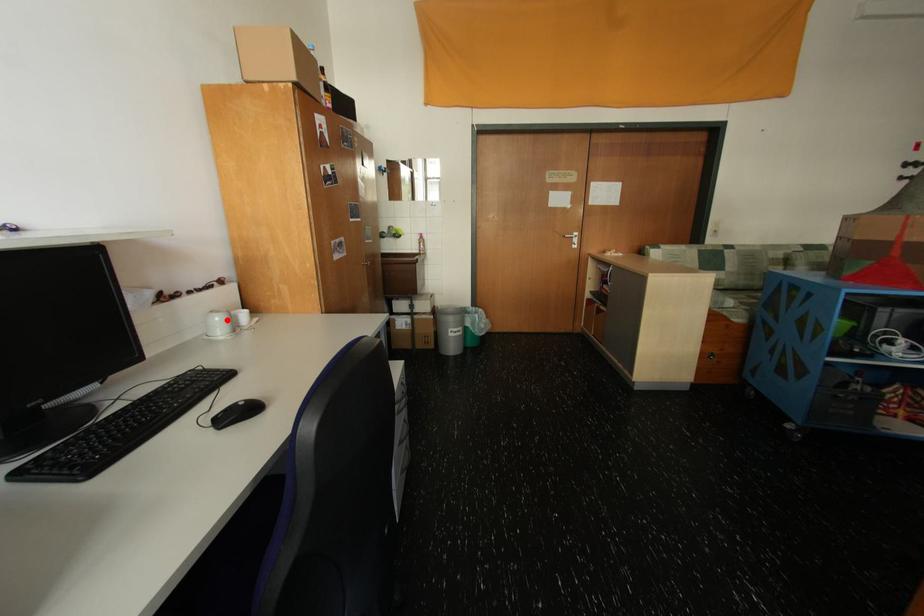
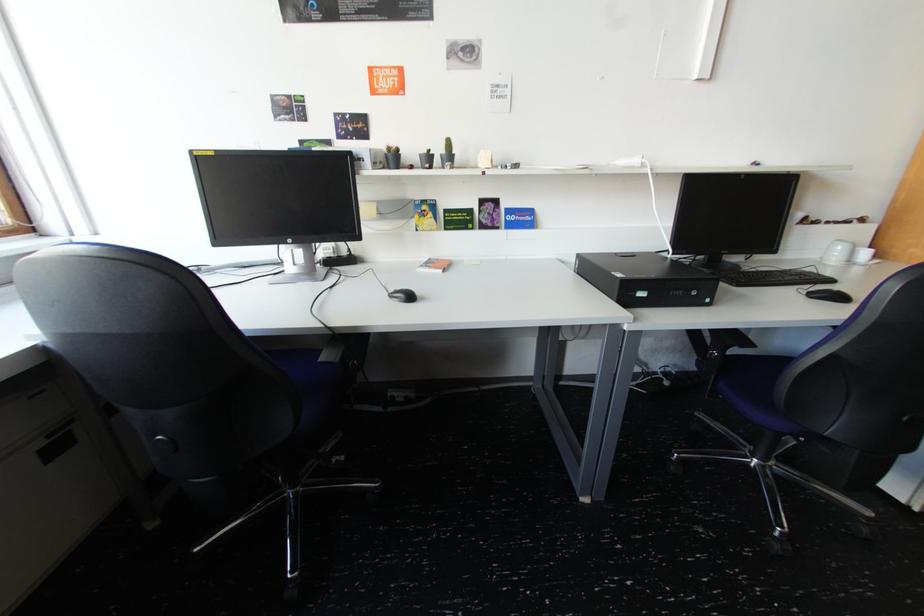
Question: I am providing you with two images of the same scene from different viewpoints. Image1 has a red point marked. In image2, the corresponding 3D location appears at what relative position? Reply with the corresponding letter.

Choices:
 (A) Closer
 (B) Farther

Answer: (B)